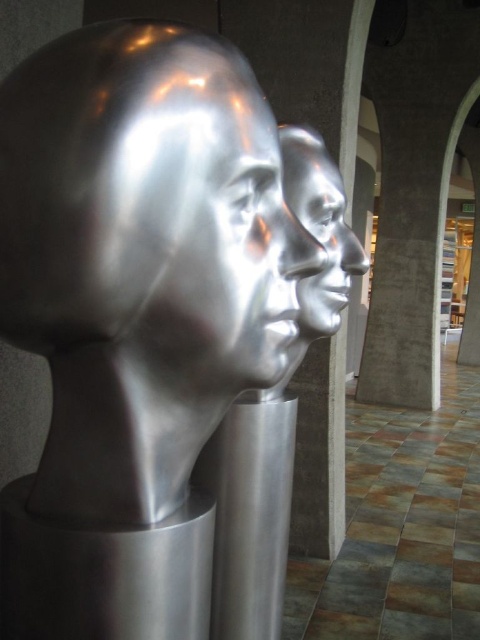
From the picture: Who is more forward, (28, 116) or (335, 308)?

Point (28, 116)

Is point (120, 189) closer to viewer compared to point (292, 179)?

That is True.

Locate an element on the screen. This screenshot has width=480, height=640. shiny metallic head at center is located at coordinates (146, 204).